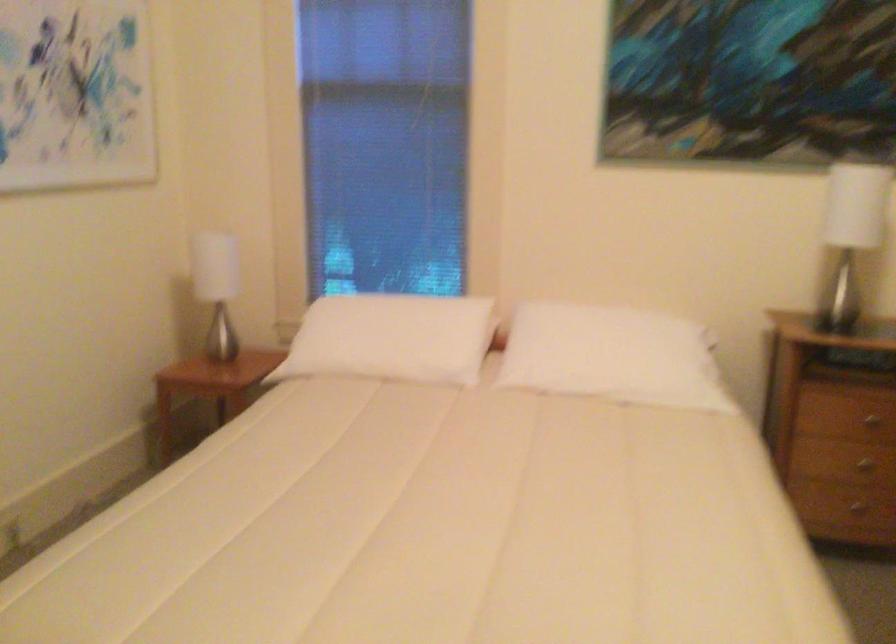
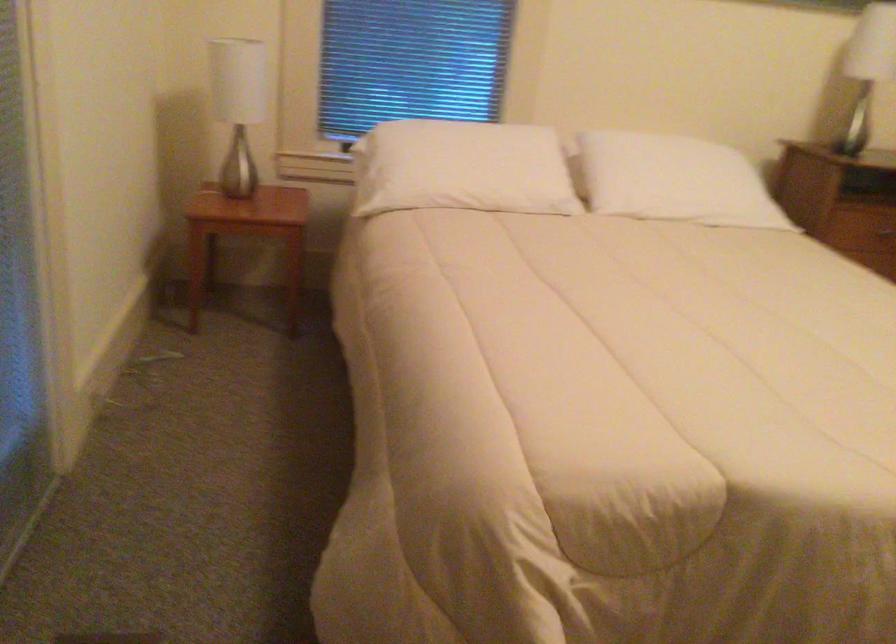
Where in the second image is the point corresponding to (x=201, y=285) from the first image?

(238, 106)